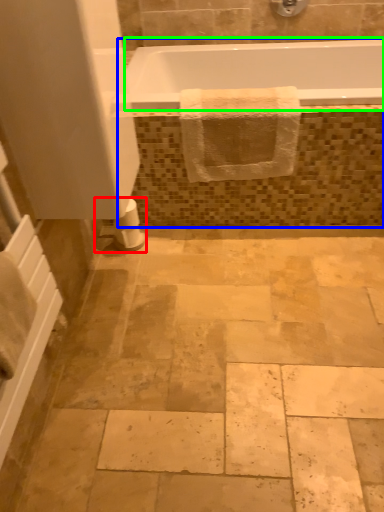
Question: Based on their relative distances, which object is farther from toilet paper (highlighted by a red box)? Choose from bath (highlighted by a blue box) and bathtub (highlighted by a green box).

Choices:
 (A) bath
 (B) bathtub

Answer: (B)